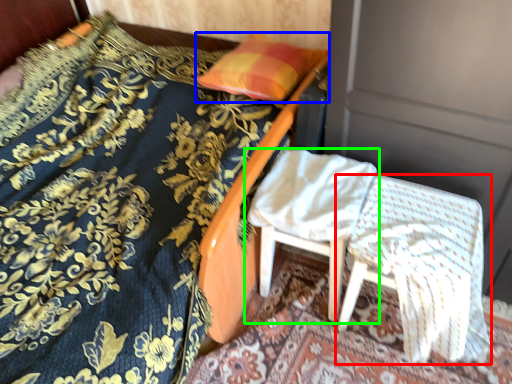
Question: Which is farther away from chair (highlighted by a red box)? pillow (highlighted by a blue box) or chair (highlighted by a green box)?

Choices:
 (A) pillow
 (B) chair

Answer: (A)